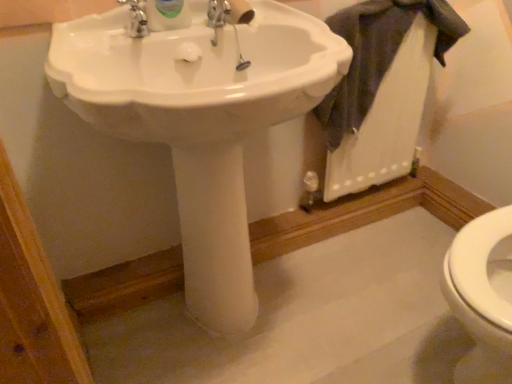
Where is `vacant area that lies to the right of white glossy sink at center`? The width and height of the screenshot is (512, 384). vacant area that lies to the right of white glossy sink at center is located at coordinates (361, 286).